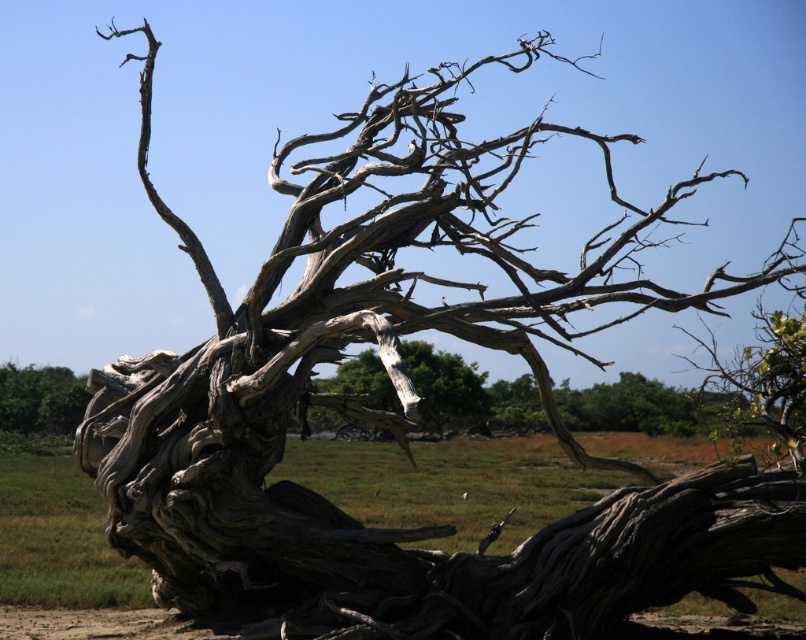
Question: Is gray textured driftwood at center wider than gray rough bark tree at center?

Choices:
 (A) yes
 (B) no

Answer: (B)

Question: Which point is closer to the camera taking this photo?

Choices:
 (A) (688, 417)
 (B) (36, 403)
 (C) (443, 413)

Answer: (A)

Question: Which object is the farthest from the gray rough bark tree at center?

Choices:
 (A) gray textured driftwood at center
 (B) gray rough bark tree at lower left

Answer: (A)

Question: Which point is closer to the camera taking this photo?

Choices:
 (A) (433, 403)
 (B) (667, 404)

Answer: (A)

Question: Is gray textured driftwood at center above gray rough bark tree at lower left?

Choices:
 (A) yes
 (B) no

Answer: (A)

Question: Can you confirm if gray textured driftwood at center is positioned below gray rough bark tree at lower left?

Choices:
 (A) yes
 (B) no

Answer: (B)